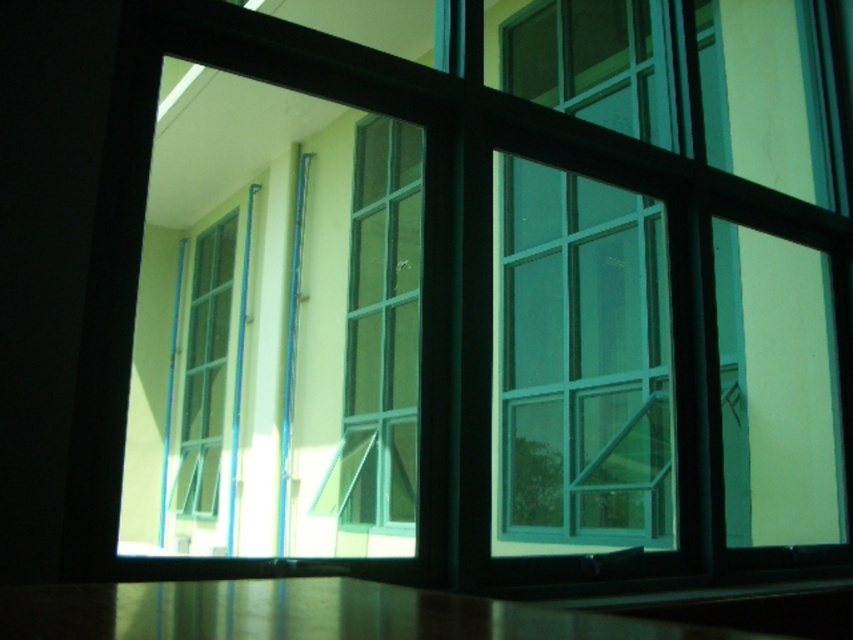
You are standing outside the building looking through the window. There are two points marked in the image at coordinates point (310,632) and point (393,358). Which point is closer to you?

Point (310,632) is closer to the camera than point (393,358).

You are standing in front of the window and want to place a 60 cm wide painting on the metallic polished table at lower center. Can the painting fit on the table?

The metallic polished table at lower center is 64.41 centimeters from viewer. Since the painting is 60 cm wide, it can fit on the table as the table is wider than the painting.